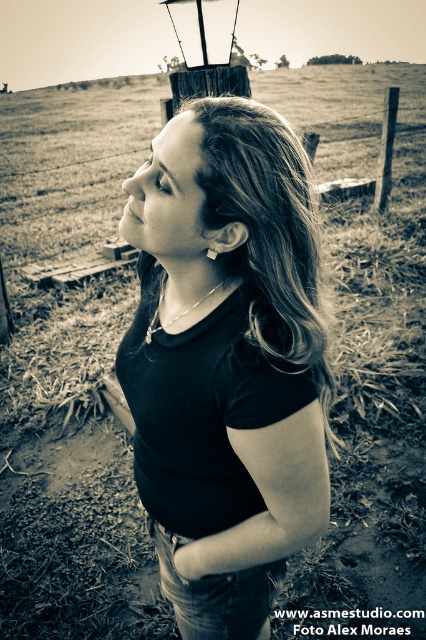
You are a photographer trying to capture the scene from above. If you want to focus on the black matte shirt at center without the dirt field at center blocking the view, where should you position your camera?

The black matte shirt at center is located below the dirt field at center, so positioning the camera above the dirt field at center would allow you to capture the shirt without obstruction.

You are a photographer trying to capture the scene. You notice the black matte shirt at center and the dirt field at center. Which object should you focus on first if you want to ensure both are in sharp focus, given that your camera can only focus on one subject at a time?

The dirt field at center is taller than the black matte shirt at center, so focusing on the dirt field at center will help ensure both are in sharp focus.